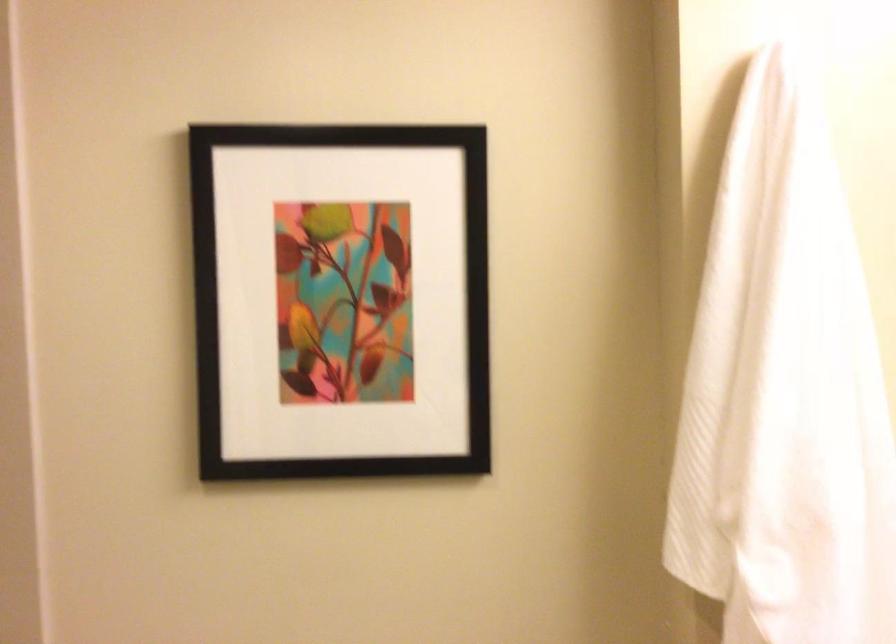
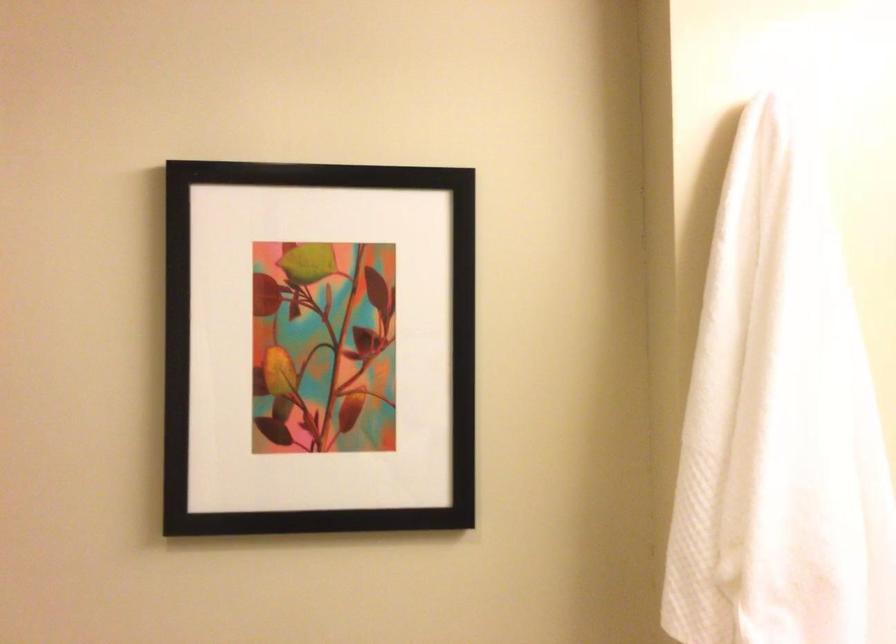
The point at [337,304] is marked in the first image. Where is the corresponding point in the second image?

(317, 348)